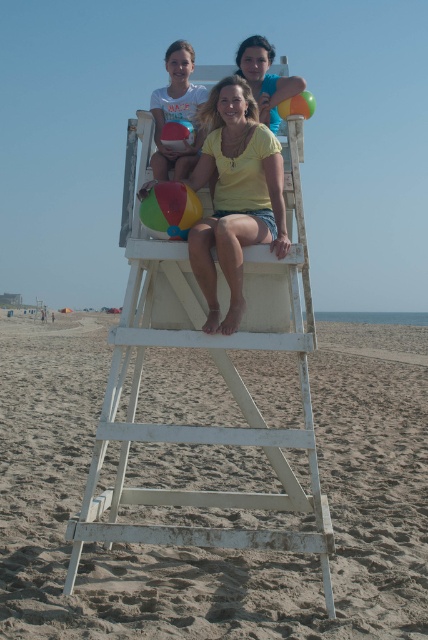
Consider the image. You are a photographer standing at the edge of the beach, and you want to take a photo of the white wooden lifeguard chair at center and the matte yellow shirt at upper center. If your camera has a maximum focus range of 30 feet, can you capture both subjects clearly in one shot?

The white wooden lifeguard chair at center is 34.04 feet from the matte yellow shirt at upper center. Since the distance between them exceeds the camera maximum focus range of 30 feet, you cannot capture both subjects clearly in one shot.

You are a photographer taking a picture of the white wooden lifeguard chair at center and the yellow matte shirt at center. Which object should you focus on first if you want to capture both in sharp focus?

The white wooden lifeguard chair at center is below the yellow matte shirt at center, so you should focus on the yellow matte shirt at center first to ensure both are in sharp focus.